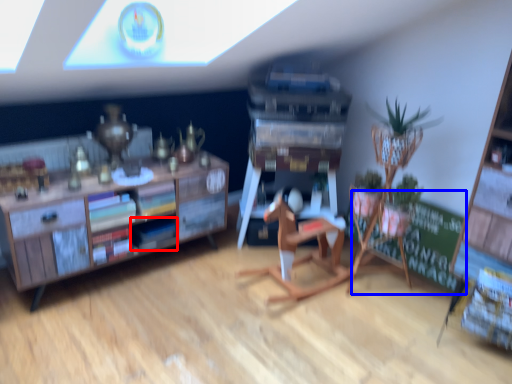
Question: Which of the following is the closest to the observer, book (highlighted by a red box) or bulletin board (highlighted by a blue box)?

Choices:
 (A) book
 (B) bulletin board

Answer: (A)